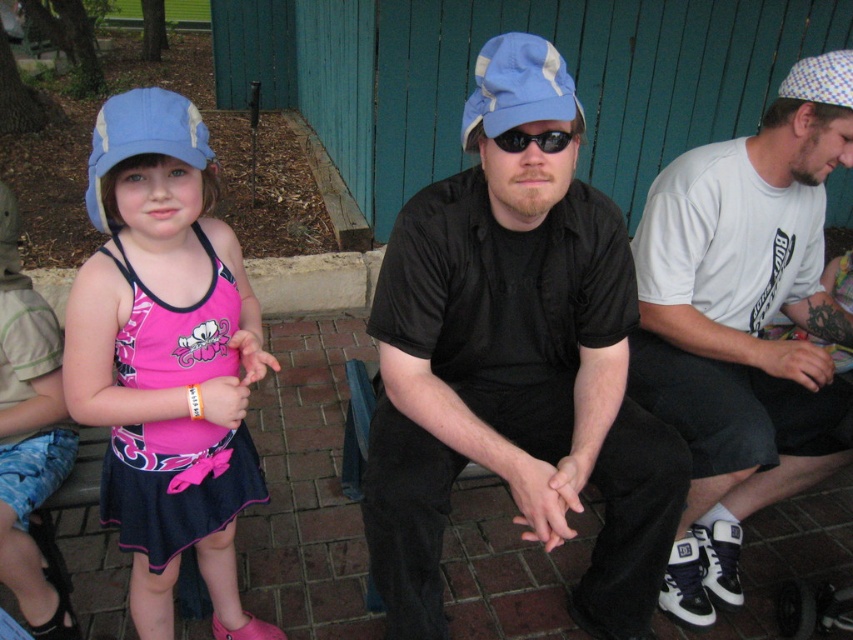
Question: Does matte pink swimsuit at left have a smaller size compared to matte blue baseball cap at left?

Choices:
 (A) no
 (B) yes

Answer: (A)

Question: Can you confirm if white cotton t-shirt at right is positioned below matte blue baseball cap at left?

Choices:
 (A) no
 (B) yes

Answer: (B)

Question: Is white cotton t-shirt at right smaller than light blue fabric baseball cap at center?

Choices:
 (A) yes
 (B) no

Answer: (B)

Question: Which object is the farthest from the light blue fabric baseball cap at center?

Choices:
 (A) matte pink swimsuit at left
 (B) matte black shirt at center
 (C) black plastic sunglasses at center

Answer: (A)

Question: Among these points, which one is nearest to the camera?

Choices:
 (A) (473, 132)
 (B) (532, 138)
 (C) (123, 104)

Answer: (C)

Question: Which of the following is the closest to the observer?

Choices:
 (A) (497, 144)
 (B) (201, 410)
 (C) (531, 74)

Answer: (C)